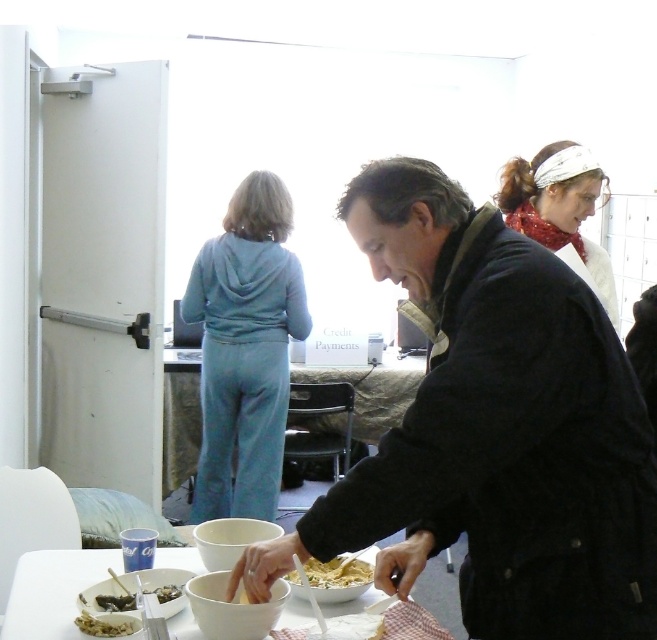
Between point (242, 480) and point (170, 593), which one is positioned behind?

Positioned behind is point (242, 480).

I want to click on light blue fabric pants at center, so click(x=244, y=349).

Does white matte table at center have a smaller size compared to shiny metallic spoon at lower left?

No, white matte table at center is not smaller than shiny metallic spoon at lower left.

Where is `white matte table at center`? This screenshot has height=640, width=657. white matte table at center is located at coordinates (53, 592).

Identify the location of white matte table at center. (53, 592).

Does white matte pasta at center appear on the right side of crumbly brown bread at lower left?

Correct, you'll find white matte pasta at center to the right of crumbly brown bread at lower left.

Find the location of a particular element. white matte pasta at center is located at coordinates (336, 572).

Which is behind, point (361, 563) or point (97, 616)?

The point (361, 563) is more distant.

Where is `white matte pasta at center`? This screenshot has height=640, width=657. white matte pasta at center is located at coordinates (336, 572).